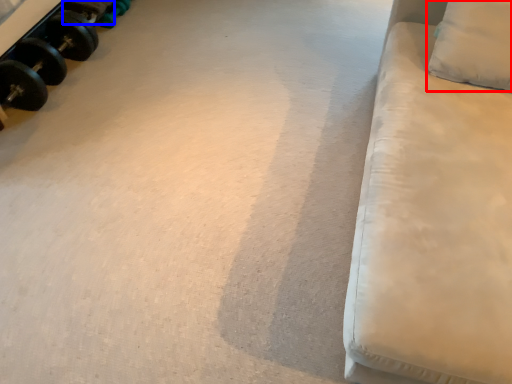
Question: Which point is further to the camera, pillow (highlighted by a red box) or dumbbell (highlighted by a blue box)?

Choices:
 (A) pillow
 (B) dumbbell

Answer: (B)